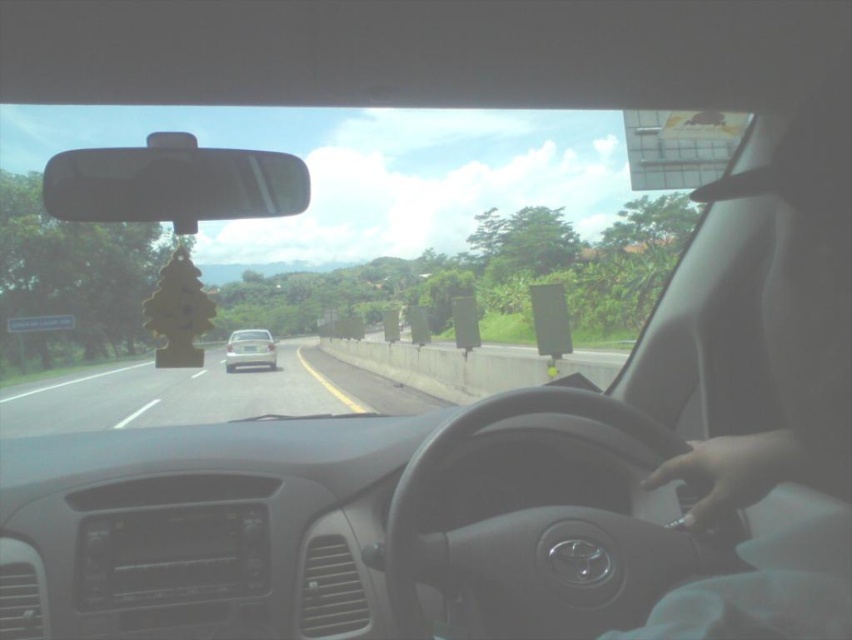
Question: Which point is farther from the camera taking this photo?

Choices:
 (A) (440, 234)
 (B) (130, 376)
 (C) (245, 342)
 (D) (213, 202)

Answer: (A)

Question: Among these points, which one is farthest from the camera?

Choices:
 (A) (355, 378)
 (B) (289, 269)

Answer: (B)

Question: Does white glossy car at center have a smaller size compared to black matte view mirror at upper center?

Choices:
 (A) yes
 (B) no

Answer: (B)

Question: Is transparent glass windshield at center above white glossy car at center?

Choices:
 (A) no
 (B) yes

Answer: (B)

Question: Based on their relative distances, which object is nearer to the transparent glass windshield at center?

Choices:
 (A) black matte view mirror at upper center
 (B) white glossy car at center

Answer: (B)

Question: Does white glossy car at center appear on the right side of matte silver sedan at center?

Choices:
 (A) yes
 (B) no

Answer: (A)